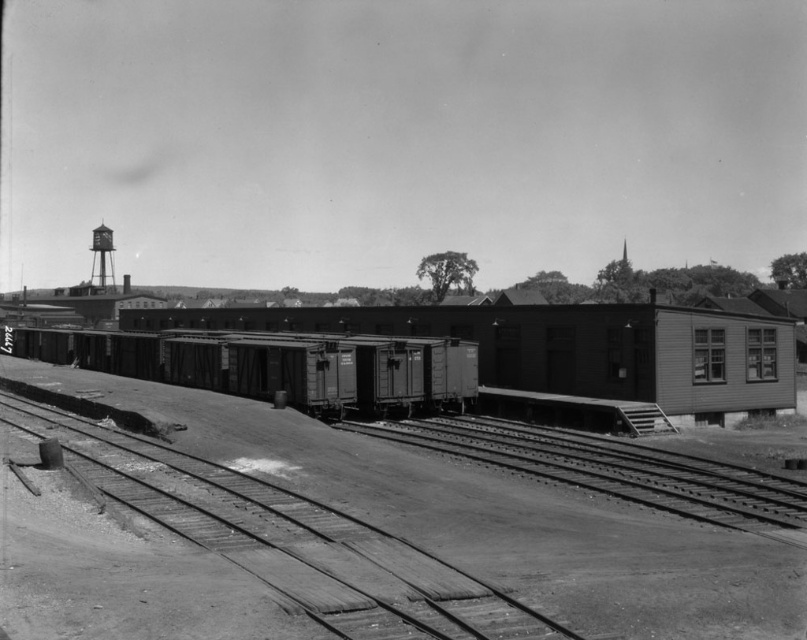
Does smooth wood train track at lower left appear on the right side of smooth metal train car at center?

Correct, you'll find smooth wood train track at lower left to the right of smooth metal train car at center.

Is smooth wood train track at lower left below smooth metal train car at center?

Correct, smooth wood train track at lower left is located below smooth metal train car at center.

Identify the location of smooth wood train track at lower left. (286, 538).

Between smooth wood train track at lower left and smooth metal track at center, which one is positioned higher?

Positioned higher is smooth wood train track at lower left.

How distant is smooth wood train track at lower left from smooth metal track at center?

smooth wood train track at lower left is 36.36 feet from smooth metal track at center.

Image resolution: width=807 pixels, height=640 pixels. What do you see at coordinates (286, 538) in the screenshot?
I see `smooth wood train track at lower left` at bounding box center [286, 538].

Find the location of a particular element. smooth wood train track at lower left is located at coordinates (286, 538).

Is the position of smooth wood train track at lower left more distant than that of smooth metal water tower at upper left?

No, smooth wood train track at lower left is in front of smooth metal water tower at upper left.

Is smooth wood train track at lower left wider than smooth metal water tower at upper left?

Incorrect, smooth wood train track at lower left's width does not surpass smooth metal water tower at upper left's.

Is point (134, 444) closer to camera compared to point (109, 250)?

Yes, it is in front of point (109, 250).

Where is `smooth wood train track at lower left`? The width and height of the screenshot is (807, 640). smooth wood train track at lower left is located at coordinates (286, 538).